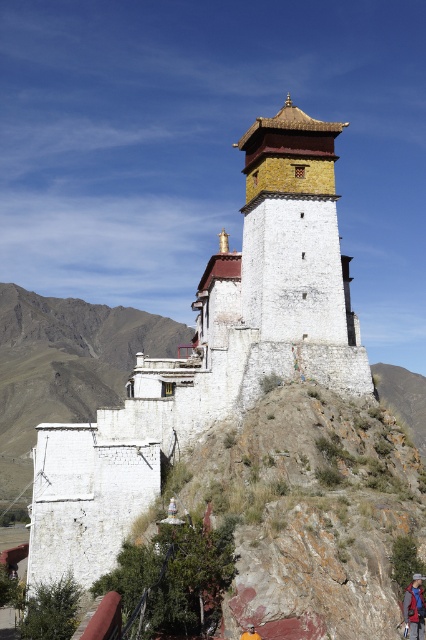
What are the coordinates of `white stone temple at center` in the screenshot? It's located at pos(210,353).

Between point (199, 326) and point (408, 604), which one is positioned behind?

The point (199, 326) is behind.

Locate an element on the screen. This screenshot has width=426, height=640. white stone temple at center is located at coordinates (210, 353).

Which is above, blue fabric backpack at center or brown leather hat at center?

blue fabric backpack at center is above.

Locate an element on the screen. This screenshot has height=640, width=426. blue fabric backpack at center is located at coordinates (414, 608).

Does white stone temple at center have a greater height compared to brown leather hat at center?

Indeed, white stone temple at center has a greater height compared to brown leather hat at center.

Is point (319, 189) positioned behind point (247, 630)?

Yes, it is.

Locate an element on the screen. This screenshot has width=426, height=640. white stone temple at center is located at coordinates (210, 353).